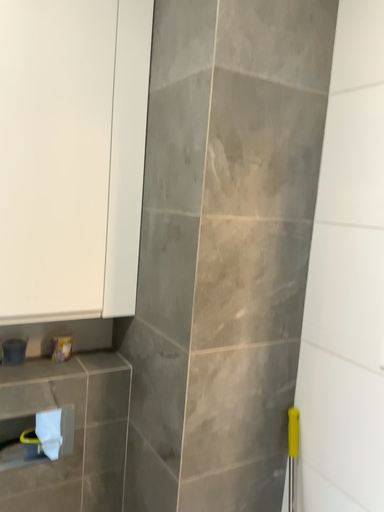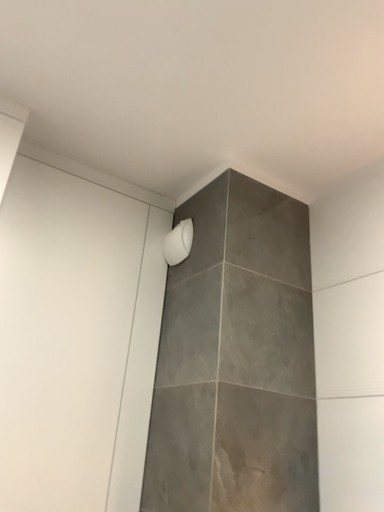
Question: How did the camera likely rotate when shooting the video?

Choices:
 (A) rotated downward
 (B) rotated upward

Answer: (B)